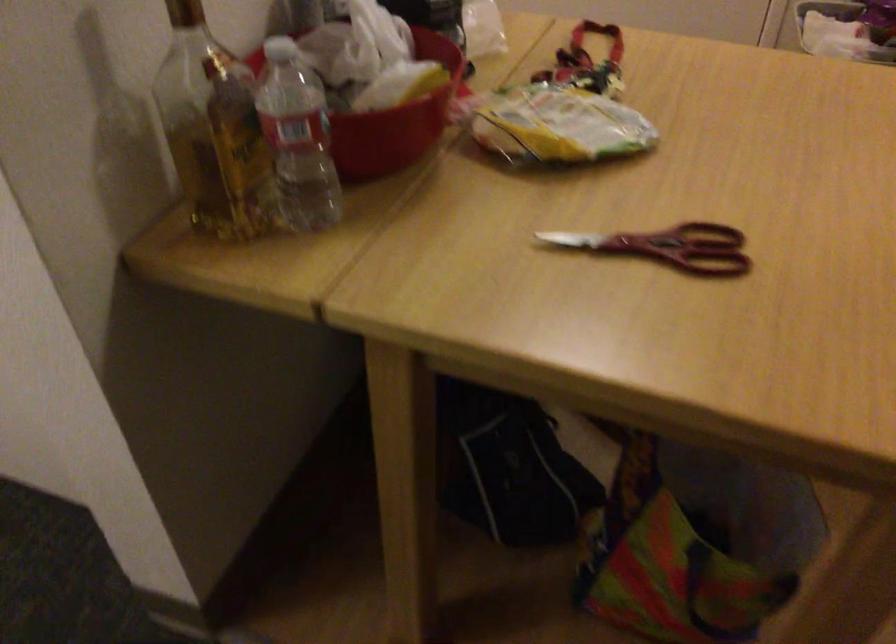
The width and height of the screenshot is (896, 644). What do you see at coordinates (297, 138) in the screenshot? I see `the clear plastic bottle` at bounding box center [297, 138].